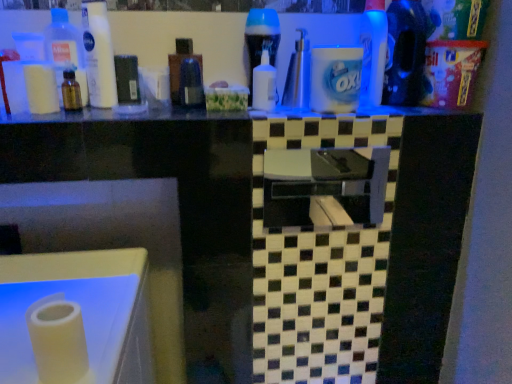
Find the location of a particular element. unoccupied area in front of white matte lotion at upper left, marked as the third cleaning product in a right-to-left arrangement is located at coordinates (81, 113).